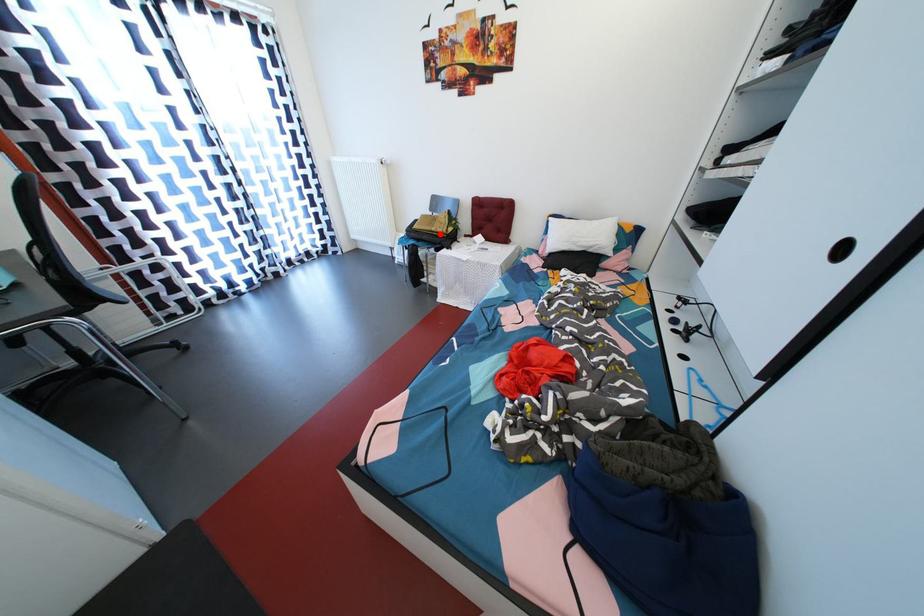
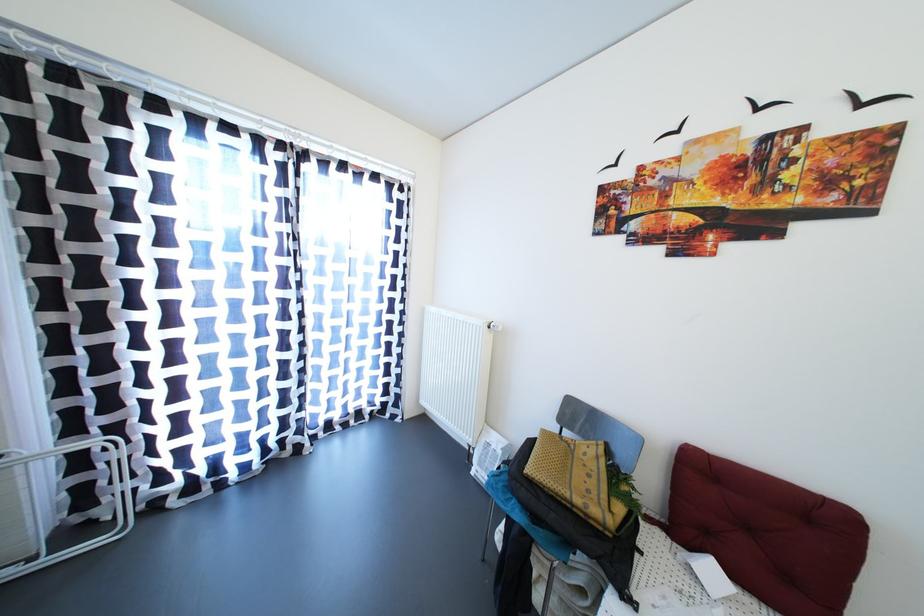
Question: I am providing you with two images of the same scene from different viewpoints. A red point is marked on the first image. Is the red point's position out of view in image 2?

Choices:
 (A) Yes
 (B) No

Answer: (B)